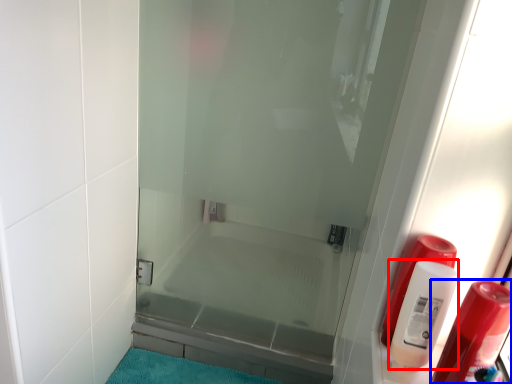
Question: Which point is closer to the camera, cleaning product (highlighted by a red box) or soap dispenser (highlighted by a blue box)?

Choices:
 (A) cleaning product
 (B) soap dispenser

Answer: (B)